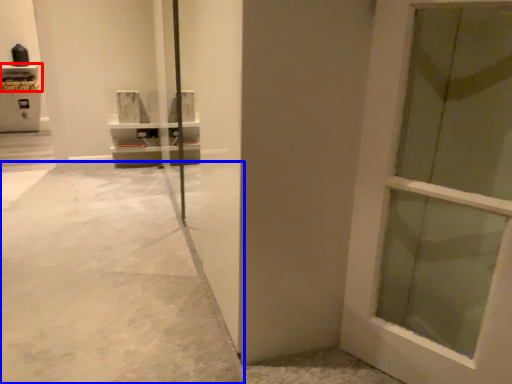
Question: Which object appears closest to the camera in this image, shelf (highlighted by a red box) or concrete (highlighted by a blue box)?

Choices:
 (A) shelf
 (B) concrete

Answer: (B)